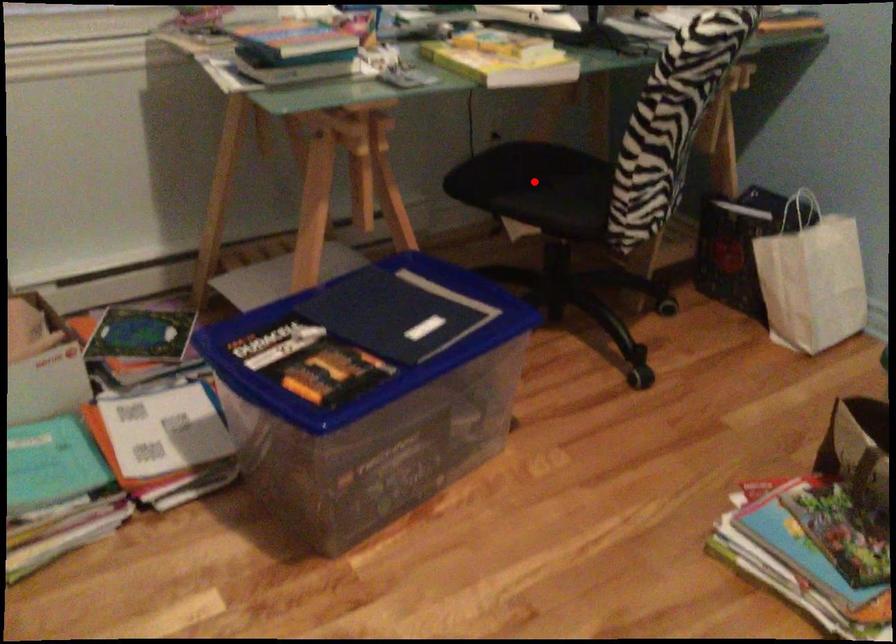
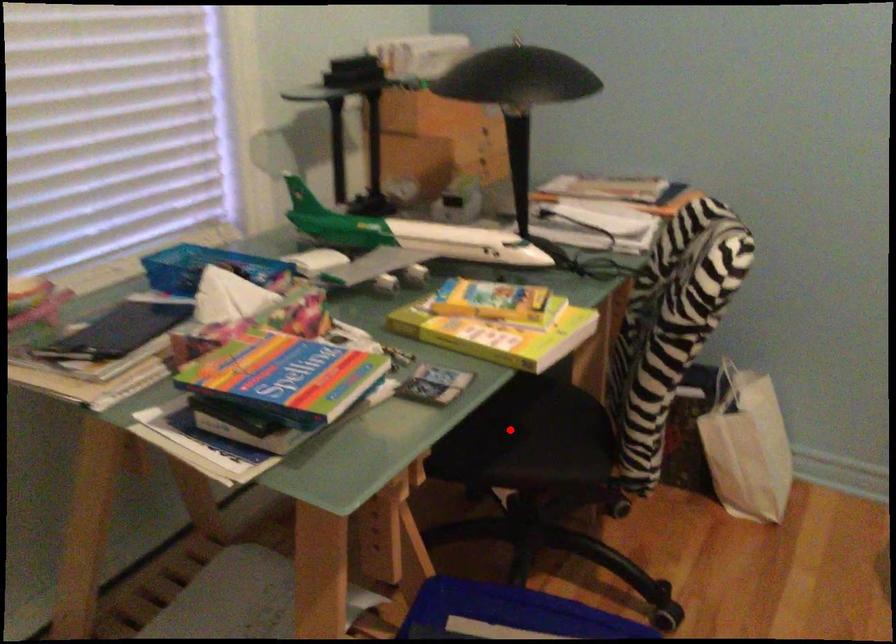
I am providing you with two images of the same scene from different viewpoints. A red point is marked on the first image and another point is marked on the second image. Does the point marked in image1 correspond to the same location as the one in image2?

Yes